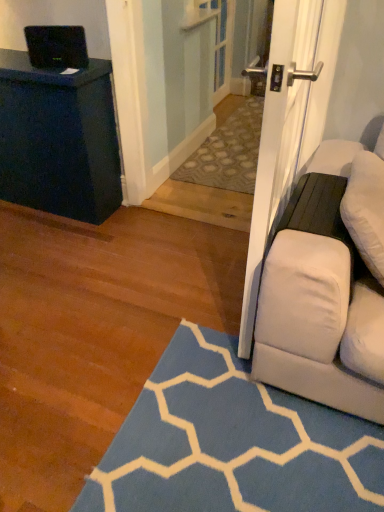
At what (x,y) coordinates should I click in order to perform the action: click on black matte computer at upper left. Please return your answer as a coordinate pair (x, y). Image resolution: width=384 pixels, height=512 pixels. Looking at the image, I should click on coord(57,47).

In order to face black matte computer at upper left, should I rotate leftwards or rightwards?

Rotate your view left by about 17.658°.

What do you see at coordinates (57, 47) in the screenshot? This screenshot has height=512, width=384. I see `black matte computer at upper left` at bounding box center [57, 47].

I want to click on black matte computer at upper left, so click(x=57, y=47).